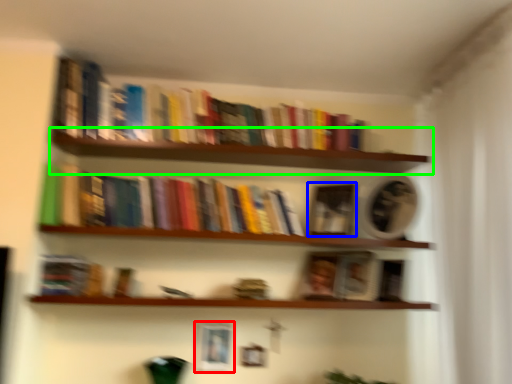
Question: Which is nearer to the picture frame (highlighted by a red box)? paperback book (highlighted by a blue box) or shelf (highlighted by a green box).

Choices:
 (A) paperback book
 (B) shelf

Answer: (A)